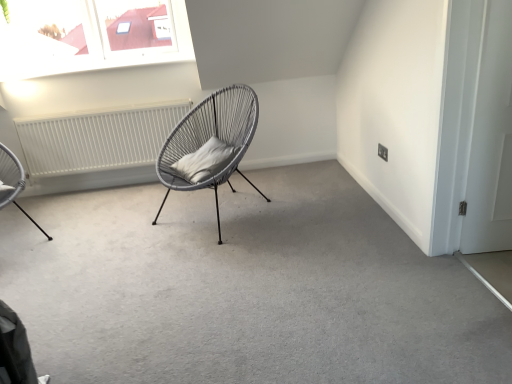
Image resolution: width=512 pixels, height=384 pixels. In order to click on matte grey wicker chair at center, which appears as the 2th chair when viewed from the left in this screenshot , I will do `click(211, 135)`.

Describe the element at coordinates (211, 135) in the screenshot. I see `matte grey wicker chair at center, which is counted as the 1th chair, starting from the right` at that location.

What is the approximate width of white matte door at right?

white matte door at right is 2.43 inches wide.

What do you see at coordinates (13, 182) in the screenshot? The image size is (512, 384). I see `metallic wire chair at left, which is the 1th chair from left to right` at bounding box center [13, 182].

Find the location of `gray fabric pillow at center`. gray fabric pillow at center is located at coordinates (204, 161).

Measure the distance from white matte door at right to gray fabric pillow at center.

The distance of white matte door at right from gray fabric pillow at center is 1.49 meters.

Can you tell me how much white matte door at right and gray fabric pillow at center differ in facing direction?

The angle between the facing direction of white matte door at right and the facing direction of gray fabric pillow at center is 55.6 degrees.

Are white matte door at right and gray fabric pillow at center making contact?

white matte door at right and gray fabric pillow at center are not in contact.

From the picture: From a real-world perspective, is white matte door at right on top of gray fabric pillow at center?

Yes, from a real-world perspective, white matte door at right is on top of gray fabric pillow at center.

Is metallic wire chair at left, which is the second chair from right to left, not within matte grey wicker chair at center, which is counted as the 1th chair, starting from the right?

Yes, metallic wire chair at left, which is the second chair from right to left, is located beyond the bounds of matte grey wicker chair at center, which is counted as the 1th chair, starting from the right.

Considering the sizes of objects metallic wire chair at left, which is the second chair from right to left, and matte grey wicker chair at center, which is counted as the 1th chair, starting from the right, in the image provided, who is thinner, metallic wire chair at left, which is the second chair from right to left, or matte grey wicker chair at center, which is counted as the 1th chair, starting from the right,?

With smaller width is metallic wire chair at left, which is the second chair from right to left.

Is metallic wire chair at left, which is the second chair from right to left, in front of matte grey wicker chair at center, which is counted as the 1th chair, starting from the right?

No, metallic wire chair at left, which is the second chair from right to left, is behind matte grey wicker chair at center, which is counted as the 1th chair, starting from the right.

Is metallic wire chair at left, which is the 1th chair from left to right, shorter than matte grey wicker chair at center, which is counted as the 1th chair, starting from the right?

No, metallic wire chair at left, which is the 1th chair from left to right, is not shorter than matte grey wicker chair at center, which is counted as the 1th chair, starting from the right.

Measure the distance from white matte radiator at left to metallic wire chair at left, which is the 1th chair from left to right.

white matte radiator at left is 31.24 inches away from metallic wire chair at left, which is the 1th chair from left to right.

From a real-world perspective, is white matte radiator at left on metallic wire chair at left, which is the second chair from right to left?

No, from a real-world perspective, white matte radiator at left is not above metallic wire chair at left, which is the second chair from right to left.

Which of these two, white matte radiator at left or metallic wire chair at left, which is the second chair from right to left, is smaller?

Result: white matte radiator at left is smaller.

Is white matte radiator at left positioned far away from metallic wire chair at left, which is the 1th chair from left to right?

No, there isn't a large distance between white matte radiator at left and metallic wire chair at left, which is the 1th chair from left to right.

In terms of width, does white matte radiator at left look wider or thinner when compared to matte grey wicker chair at center, which appears as the 2th chair when viewed from the left?

white matte radiator at left is thinner than matte grey wicker chair at center, which appears as the 2th chair when viewed from the left.

From a real-world perspective, does white matte radiator at left stand above matte grey wicker chair at center, which is counted as the 1th chair, starting from the right?

Actually, white matte radiator at left is physically below matte grey wicker chair at center, which is counted as the 1th chair, starting from the right, in the real world.

Which is in front, white matte radiator at left or matte grey wicker chair at center, which appears as the 2th chair when viewed from the left?

matte grey wicker chair at center, which appears as the 2th chair when viewed from the left, is in front.

From a real-world perspective, who is located higher, white matte radiator at left or gray fabric pillow at center?

gray fabric pillow at center is physically above.

Would you say white matte radiator at left is to the left or to the right of gray fabric pillow at center in the picture?

In the image, white matte radiator at left appears on the left side of gray fabric pillow at center.

Is white matte radiator at left placed right next to gray fabric pillow at center?

No.

Who is smaller, white matte radiator at left or gray fabric pillow at center?

gray fabric pillow at center is smaller.

Is matte grey wicker chair at center, which appears as the 2th chair when viewed from the left, in front of gray fabric pillow at center?

Yes.

In the scene shown: Between matte grey wicker chair at center, which is counted as the 1th chair, starting from the right, and gray fabric pillow at center, which one has larger width?

matte grey wicker chair at center, which is counted as the 1th chair, starting from the right.

Is matte grey wicker chair at center, which appears as the 2th chair when viewed from the left, aimed at gray fabric pillow at center?

Yes, matte grey wicker chair at center, which appears as the 2th chair when viewed from the left, faces towards gray fabric pillow at center.

Consider the image. From the image's perspective, is matte grey wicker chair at center, which appears as the 2th chair when viewed from the left, located above white matte door at right?

No.

Considering the positions of objects matte grey wicker chair at center, which is counted as the 1th chair, starting from the right, and white matte door at right in the image provided, who is behind, matte grey wicker chair at center, which is counted as the 1th chair, starting from the right, or white matte door at right?

matte grey wicker chair at center, which is counted as the 1th chair, starting from the right.

Between matte grey wicker chair at center, which is counted as the 1th chair, starting from the right, and white matte door at right, which one has larger width?

Wider between the two is matte grey wicker chair at center, which is counted as the 1th chair, starting from the right.

Is matte grey wicker chair at center, which appears as the 2th chair when viewed from the left, facing away from white matte door at right?

matte grey wicker chair at center, which appears as the 2th chair when viewed from the left, does not have its back to white matte door at right.

Locate an element on the screen. pillow lying on the left of white matte door at right is located at coordinates (204, 161).

In order to click on chair below the metallic wire chair at left, which is the second chair from right to left (from a real-world perspective) in this screenshot , I will do `click(211, 135)`.

Based on their spatial positions, is white matte radiator at left or metallic wire chair at left, which is the second chair from right to left, further from gray fabric pillow at center?

The object further to gray fabric pillow at center is metallic wire chair at left, which is the second chair from right to left.

From the image, which object appears to be nearer to metallic wire chair at left, which is the 1th chair from left to right, matte grey wicker chair at center, which appears as the 2th chair when viewed from the left, or white matte radiator at left?

white matte radiator at left.

Estimate the real-world distances between objects in this image. Which object is further from gray fabric pillow at center, metallic wire chair at left, which is the second chair from right to left, or white matte radiator at left?

The object further to gray fabric pillow at center is metallic wire chair at left, which is the second chair from right to left.

Which object lies nearer to the anchor point gray fabric pillow at center, matte grey wicker chair at center, which is counted as the 1th chair, starting from the right, or white matte door at right?

matte grey wicker chair at center, which is counted as the 1th chair, starting from the right, lies closer to gray fabric pillow at center than the other object.

Based on the photo, which object lies nearer to the anchor point gray fabric pillow at center, white matte door at right or metallic wire chair at left, which is the 1th chair from left to right?

metallic wire chair at left, which is the 1th chair from left to right, lies closer to gray fabric pillow at center than the other object.

Considering their positions, is white matte radiator at left positioned further to metallic wire chair at left, which is the second chair from right to left, than gray fabric pillow at center?

gray fabric pillow at center is positioned further to the anchor metallic wire chair at left, which is the second chair from right to left.

Considering their positions, is white matte door at right positioned further to gray fabric pillow at center than white matte radiator at left?

white matte door at right lies further to gray fabric pillow at center than the other object.

Estimate the real-world distances between objects in this image. Which object is closer to white matte door at right, gray fabric pillow at center or matte grey wicker chair at center, which is counted as the 1th chair, starting from the right?

gray fabric pillow at center is closer to white matte door at right.

Image resolution: width=512 pixels, height=384 pixels. In order to click on chair between metallic wire chair at left, which is the 1th chair from left to right, and white matte door at right from left to right in this screenshot , I will do `click(211, 135)`.

Where is `chair between gray fabric pillow at center and white matte door at right in the horizontal direction`? This screenshot has width=512, height=384. chair between gray fabric pillow at center and white matte door at right in the horizontal direction is located at coordinates (211, 135).

Where is `pillow located between matte grey wicker chair at center, which is counted as the 1th chair, starting from the right, and white matte radiator at left in the depth direction`? pillow located between matte grey wicker chair at center, which is counted as the 1th chair, starting from the right, and white matte radiator at left in the depth direction is located at coordinates (204, 161).

Identify the location of chair between white matte radiator at left and white matte door at right in the horizontal direction. point(211,135).